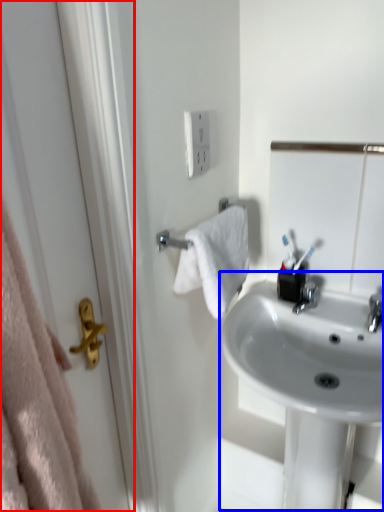
Question: Among these objects, which one is farthest to the camera, screen door (highlighted by a red box) or sink (highlighted by a blue box)?

Choices:
 (A) screen door
 (B) sink

Answer: (B)